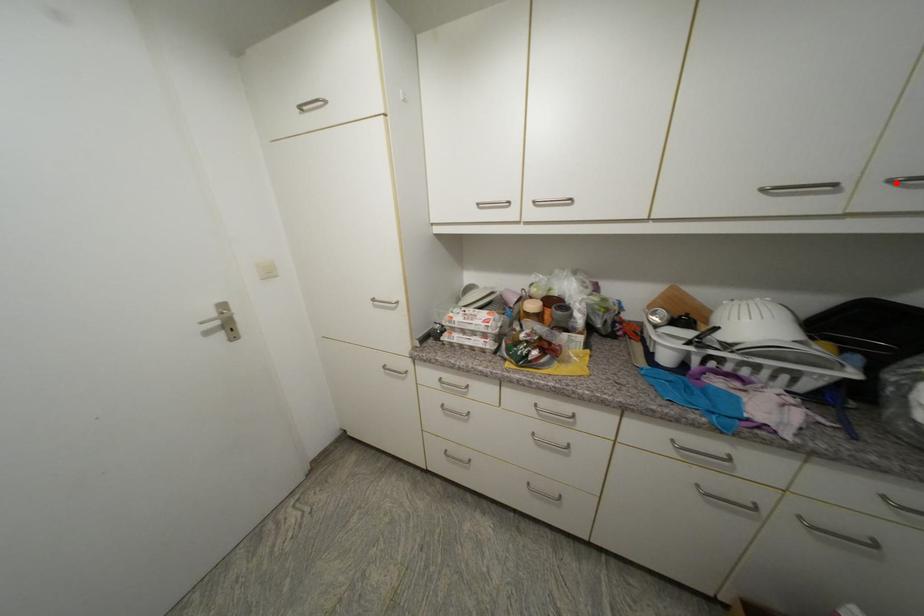
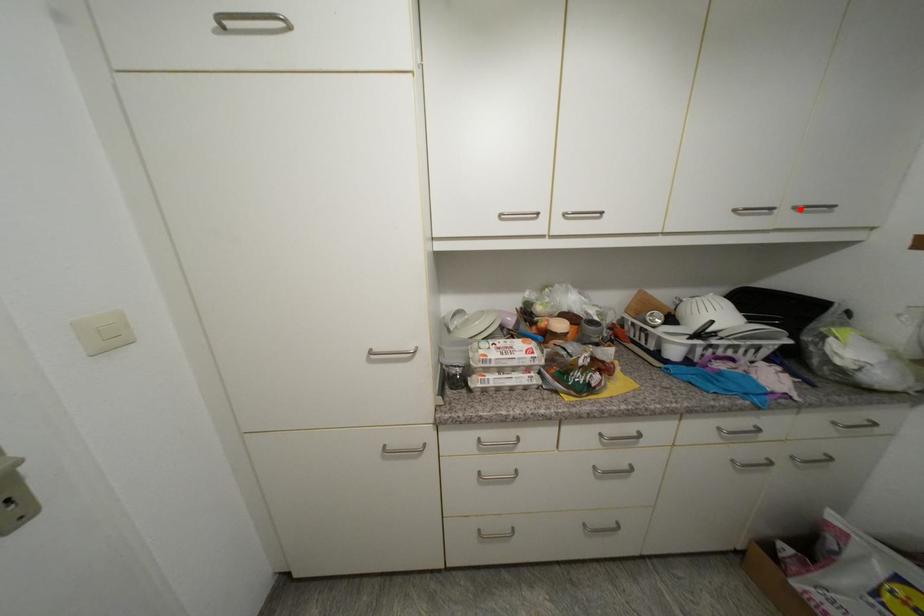
I am providing you with two images of the same scene from different viewpoints. A red point is marked on the first image and another point is marked on the second image. Is the red point in image1 aligned with the point shown in image2?

Yes